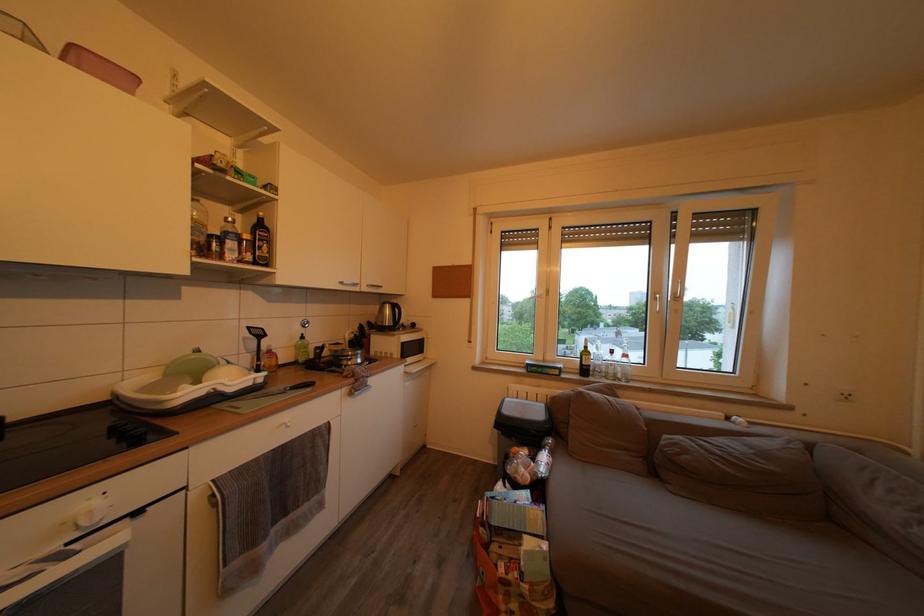
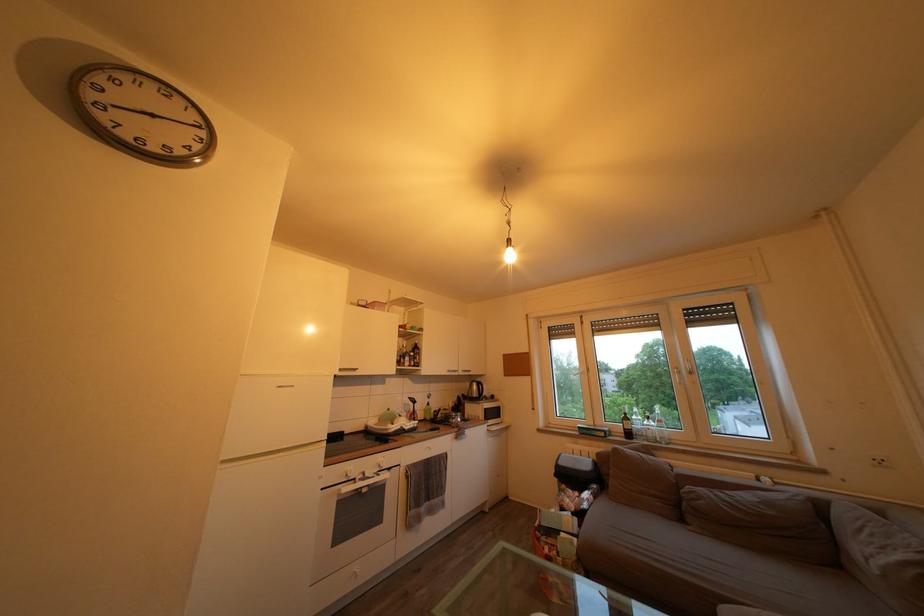
Locate, in the second image, the point that corresponds to point (856, 403) in the first image.

(889, 468)